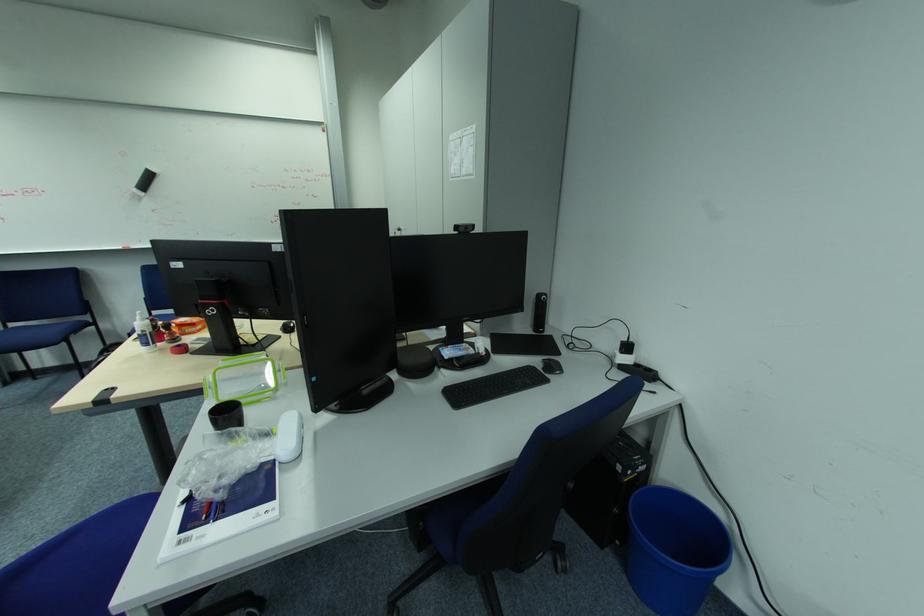
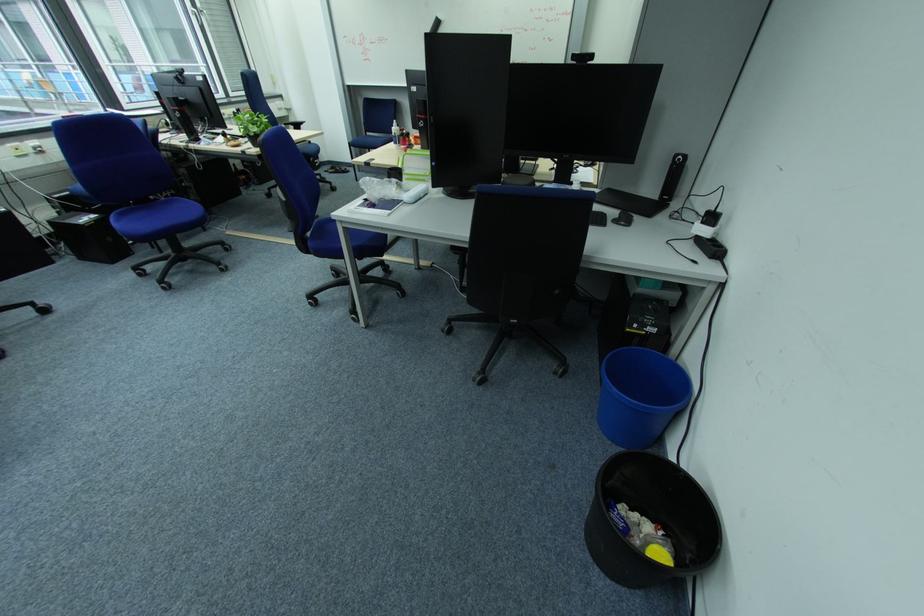
In the second image, find the point that corresponds to (x=548, y=296) in the first image.

(686, 156)